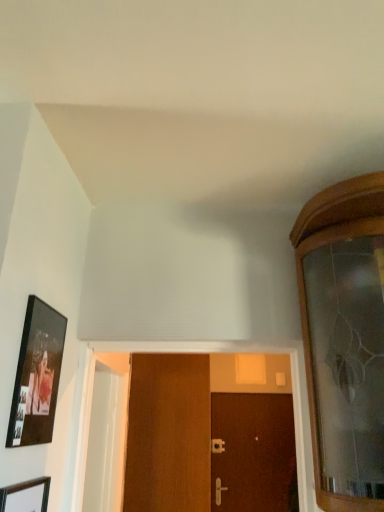
Question: From the image's perspective, is wooden picture frame at lower left, arranged as the 2th picture frame when viewed from the top, positioned above or below brown wooden door at center, which is counted as the second door, starting from the front?

Choices:
 (A) below
 (B) above

Answer: (B)

Question: In terms of size, does wooden picture frame at lower left, placed as the first picture frame when sorted from bottom to top, appear bigger or smaller than brown wooden door at center, the 1th door viewed from the right?

Choices:
 (A) big
 (B) small

Answer: (B)

Question: Which object is positioned farthest from the silver metallic door handle at center, which appears as the 1th door handle when viewed from the back?

Choices:
 (A) wooden door at center, placed as the second door when sorted from back to front
 (B) matte black picture frame at left, which ranks as the 2th picture frame in bottom-to-top order
 (C) brown wooden door at center, arranged as the second door when viewed from the left
 (D) wooden picture frame at lower left, arranged as the 2th picture frame when viewed from the top
 (E) satin gold door handle at center, which is the second door handle from top to bottom

Answer: (D)

Question: Which object is the closest to the silver metallic door handle at center, which appears as the 1th door handle when viewed from the back?

Choices:
 (A) satin gold door handle at center, arranged as the 1th door handle when ordered from the bottom
 (B) brown wooden door at center, arranged as the second door when viewed from the left
 (C) wooden door at center, which is the first door in top-to-bottom order
 (D) matte black picture frame at left, acting as the first picture frame starting from the top
 (E) wooden picture frame at lower left, placed as the first picture frame when sorted from bottom to top

Answer: (A)